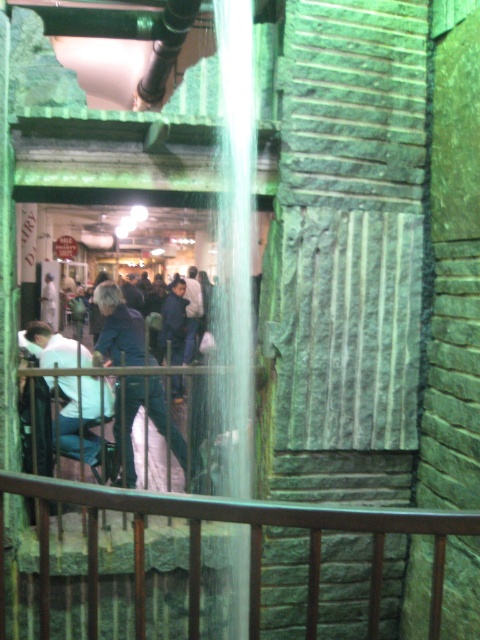
Question: Which point appears closest to the camera in this image?

Choices:
 (A) (81, 400)
 (B) (105, 410)
 (C) (0, 616)

Answer: (C)

Question: Which object is closer to the camera taking this photo?

Choices:
 (A) brown wooden rail at center
 (B) matte white shirt at center
 (C) denim jacket at center
 (D) light blue jeans at center

Answer: (A)

Question: Estimate the real-world distances between objects in this image. Which object is closer to the brown wooden rail at center?

Choices:
 (A) denim jacket at center
 (B) matte white shirt at center

Answer: (B)

Question: Does matte white shirt at center have a greater width compared to denim jacket at center?

Choices:
 (A) no
 (B) yes

Answer: (B)

Question: Considering the relative positions of denim jacket at center and light blue jeans at center in the image provided, where is denim jacket at center located with respect to light blue jeans at center?

Choices:
 (A) right
 (B) left

Answer: (A)

Question: Where is matte white shirt at center located in relation to denim jacket at center in the image?

Choices:
 (A) left
 (B) right

Answer: (A)